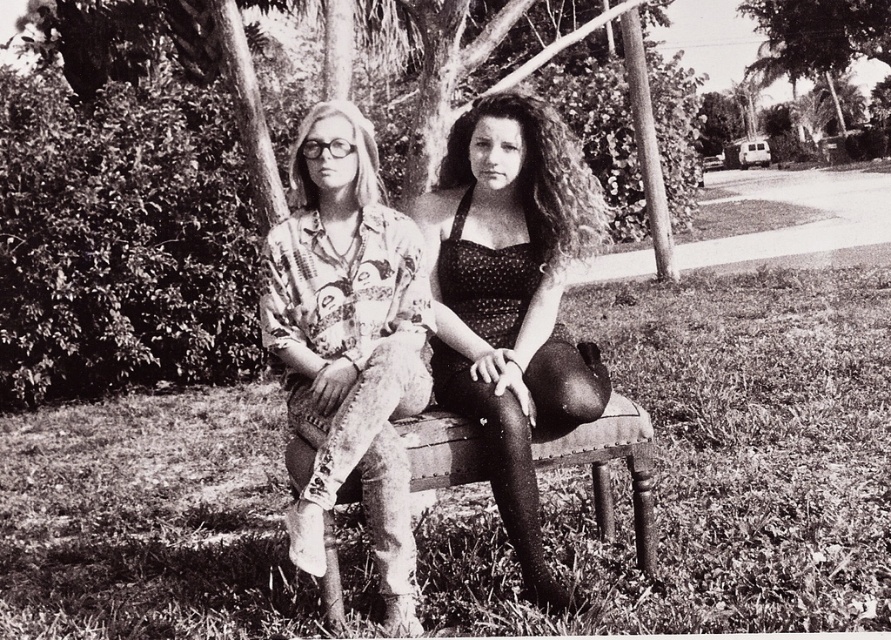
Question: Among these objects, which one is farthest from the camera?

Choices:
 (A) smooth bark tree at upper right
 (B) smooth bark tree trunk at center
 (C) printed fabric shirt at center

Answer: (A)

Question: Which point appears closest to the camera in this image?

Choices:
 (A) (260, 314)
 (B) (307, 468)
 (C) (47, 113)

Answer: (B)

Question: Which point is closer to the camera?

Choices:
 (A) polka dot fabric dress at center
 (B) printed fabric shirt at center

Answer: (B)

Question: Can you confirm if polka dot fabric dress at center is thinner than smooth bark tree at upper right?

Choices:
 (A) no
 (B) yes

Answer: (A)

Question: Can you confirm if printed fabric shirt at center is positioned to the right of faux leather bench at center?

Choices:
 (A) yes
 (B) no

Answer: (B)

Question: Does smooth bark tree trunk at center have a greater width compared to polka dot fabric dress at center?

Choices:
 (A) yes
 (B) no

Answer: (A)